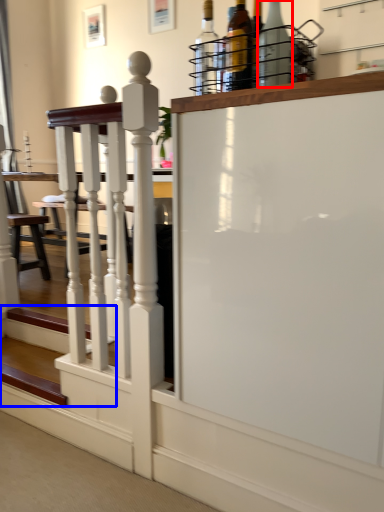
Question: Which point is further to the camera, bottle (highlighted by a red box) or stairs (highlighted by a blue box)?

Choices:
 (A) bottle
 (B) stairs

Answer: (B)